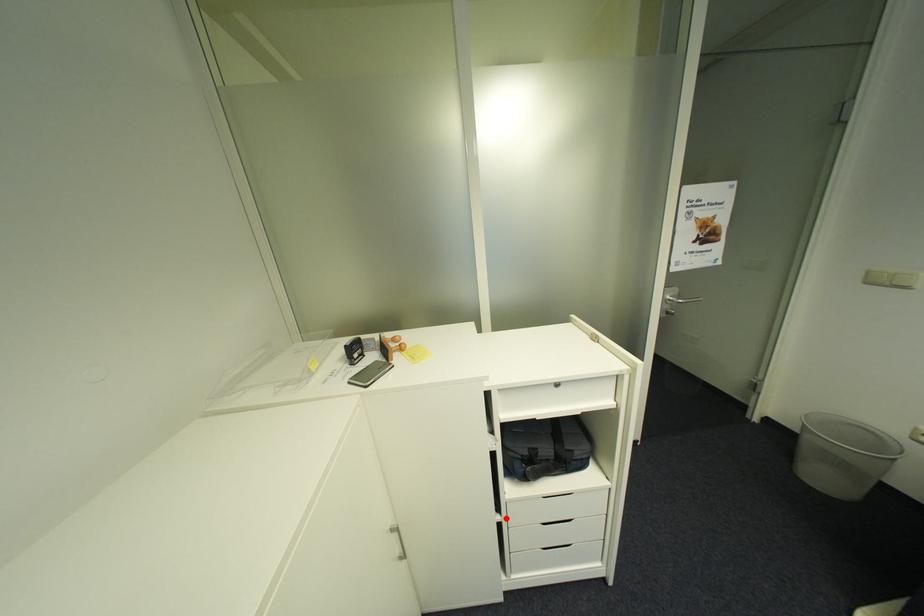
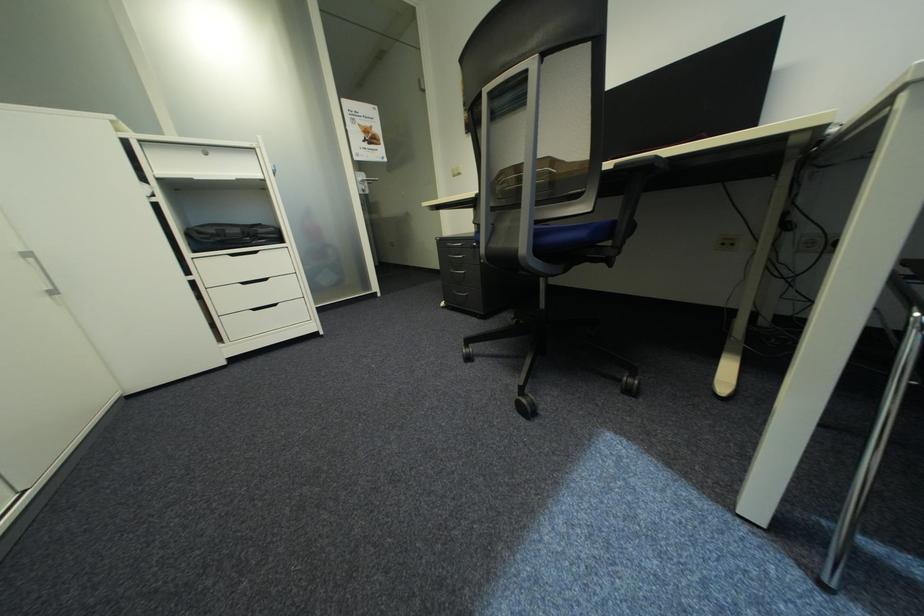
Question: I am providing you with two images of the same scene from different viewpoints. Image1 has a red point marked. In image2, the corresponding 3D location appears at what relative position? Reply with the corresponding letter.

Choices:
 (A) Closer
 (B) Farther

Answer: (A)